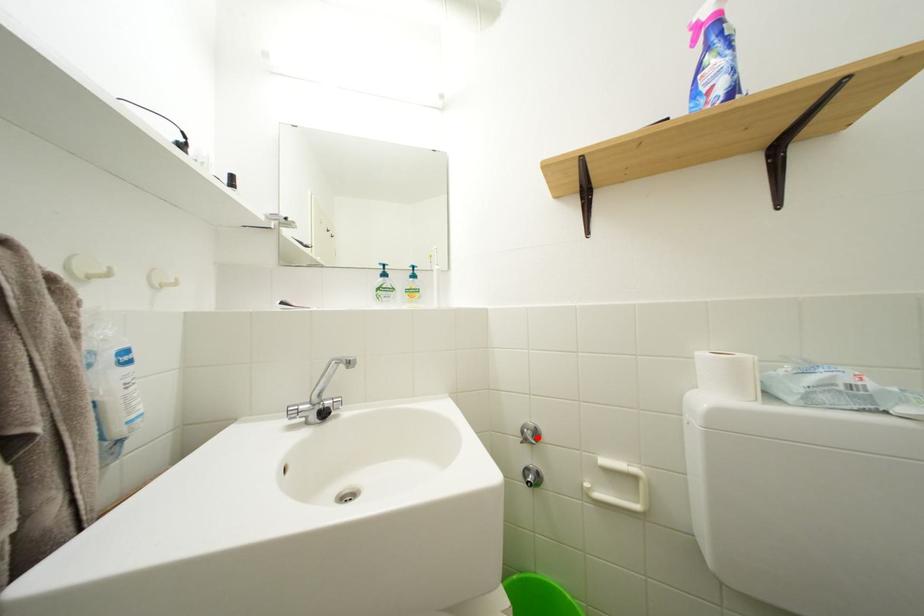
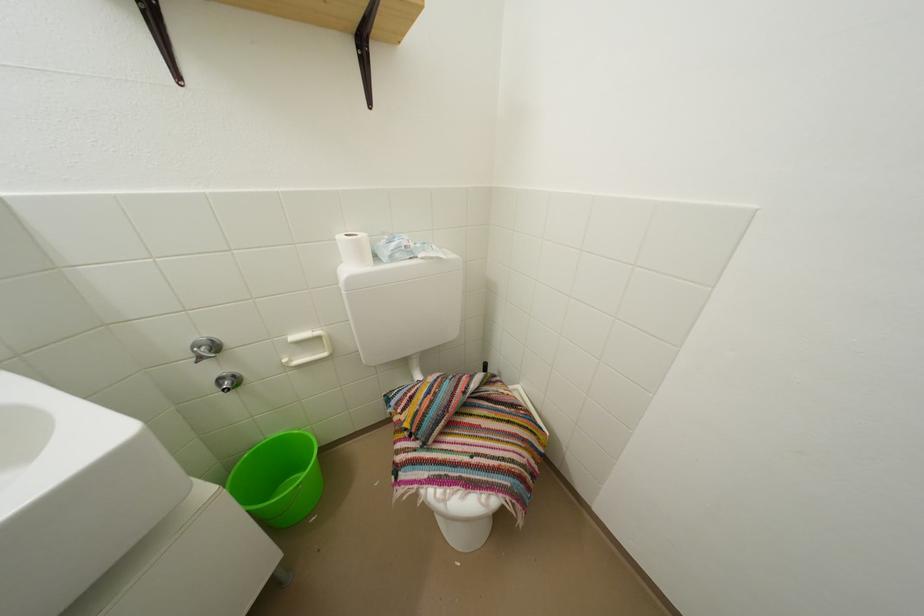
Question: I am providing you with two images of the same scene from different viewpoints. In image1, a red point is highlighted. Considering the same 3D point in image2, which of the following is correct?

Choices:
 (A) It is closer
 (B) It is farther

Answer: (A)